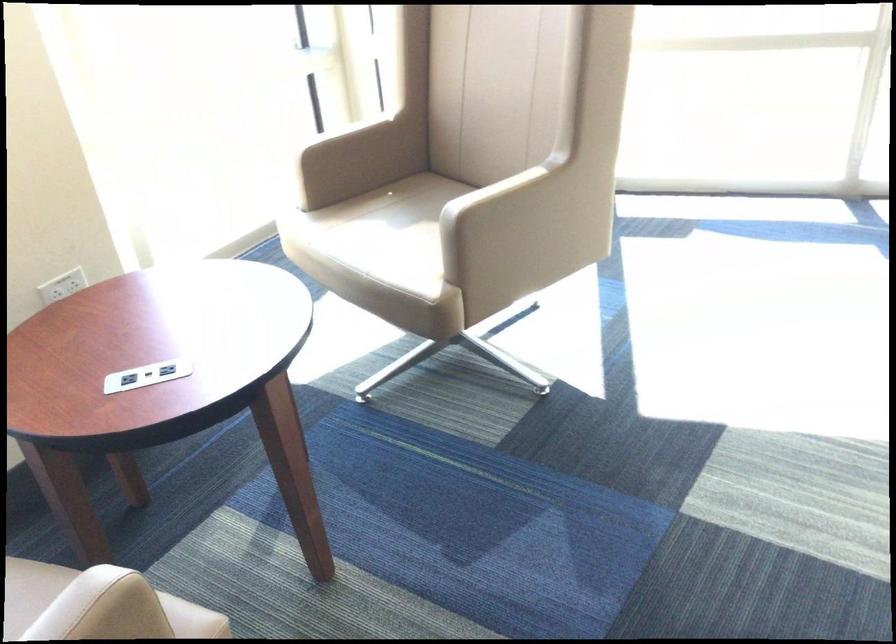
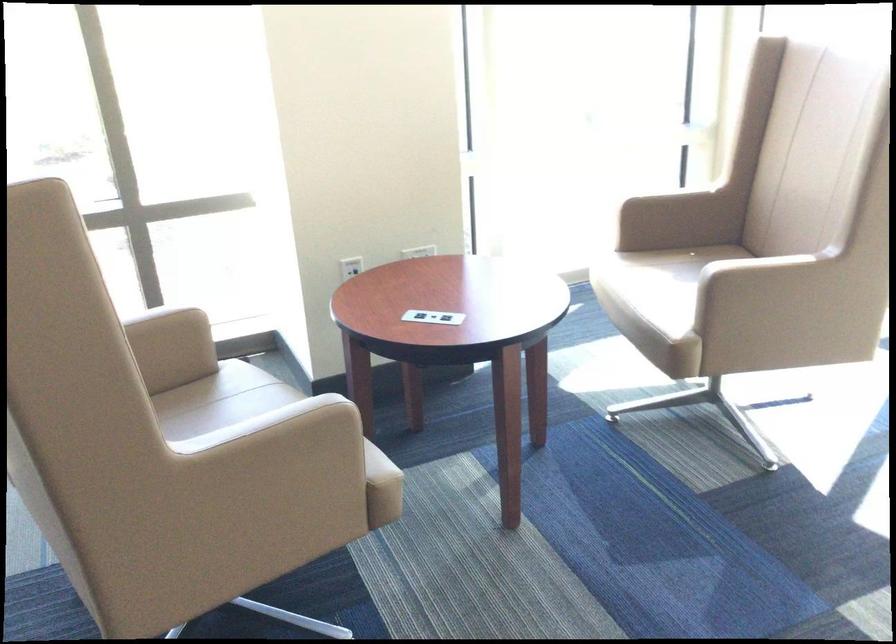
The point at (389, 247) is marked in the first image. Where is the corresponding point in the second image?

(658, 289)